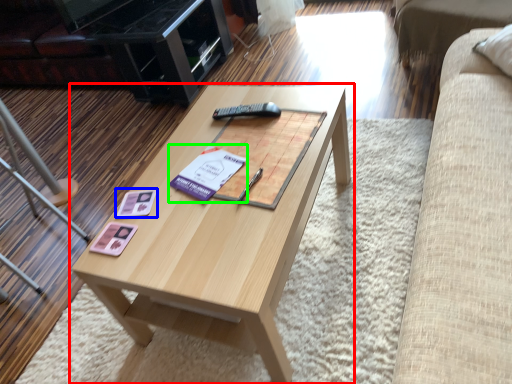
Question: Estimate the real-world distances between objects in this image. Which object is closer to coffee table (highlighted by a red box), square (highlighted by a blue box) or paperback book (highlighted by a green box)?

Choices:
 (A) square
 (B) paperback book

Answer: (B)